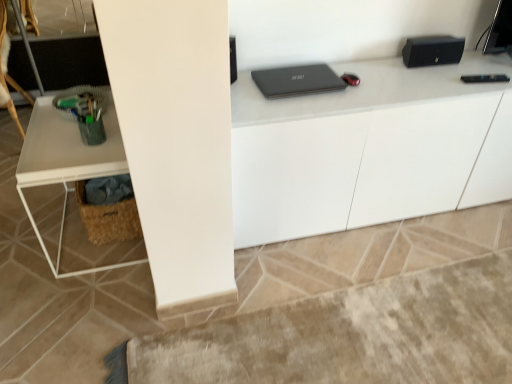
What do you see at coordinates (72, 182) in the screenshot? This screenshot has height=384, width=512. I see `white matte table at left, which is the 1th computer desk from left to right` at bounding box center [72, 182].

Describe the element at coordinates (297, 80) in the screenshot. The image size is (512, 384). I see `matte black laptop at center` at that location.

The width and height of the screenshot is (512, 384). What are the coordinates of `matte black laptop at center` in the screenshot? It's located at (297, 80).

What is the approximate width of white glossy cabinet at upper center, the second computer desk when ordered from left to right?

17.63 inches.

Identify the location of woven brown basket at lower left. (108, 218).

Is matte black laptop at center bigger than white glossy cabinet at upper center, the second computer desk when ordered from left to right?

Actually, matte black laptop at center might be smaller than white glossy cabinet at upper center, the second computer desk when ordered from left to right.

Is matte black laptop at center thinner than white glossy cabinet at upper center, which appears as the first computer desk when viewed from the right?

Indeed, matte black laptop at center has a lesser width compared to white glossy cabinet at upper center, which appears as the first computer desk when viewed from the right.

Can you confirm if matte black laptop at center is positioned to the right of white glossy cabinet at upper center, which appears as the first computer desk when viewed from the right?

No.

Consider the image. From a real-world perspective, is matte black laptop at center located beneath white glossy cabinet at upper center, the second computer desk when ordered from left to right?

Actually, matte black laptop at center is physically above white glossy cabinet at upper center, the second computer desk when ordered from left to right, in the real world.

Considering the points (20, 89) and (97, 242), which point is in front, point (20, 89) or point (97, 242)?

The point (97, 242) is in front.

From a real-world perspective, is wooden swivel chair at left located beneath woven brown basket at lower left?

No, from a real-world perspective, wooden swivel chair at left is not under woven brown basket at lower left.

Does wooden swivel chair at left appear on the left side of woven brown basket at lower left?

Yes, wooden swivel chair at left is to the left of woven brown basket at lower left.

Is matte black laptop at center further to the viewer compared to wooden swivel chair at left?

No, it is not.

Is matte black laptop at center facing away from wooden swivel chair at left?

matte black laptop at center does not have its back to wooden swivel chair at left.

Based on the photo, does matte black laptop at center contain wooden swivel chair at left?

No, matte black laptop at center does not contain wooden swivel chair at left.

Between point (4, 72) and point (271, 86), which one is positioned in front?

The point (271, 86) is closer to the camera.

Is wooden swivel chair at left facing away from matte black laptop at center?

That's not correct — wooden swivel chair at left is not looking away from matte black laptop at center.

In the scene shown: From the image's perspective, is wooden swivel chair at left located beneath matte black laptop at center?

No, from the image's perspective, wooden swivel chair at left is not below matte black laptop at center.

Considering the relative sizes of wooden swivel chair at left and matte black laptop at center in the image provided, is wooden swivel chair at left shorter than matte black laptop at center?

Incorrect, the height of wooden swivel chair at left does not fall short of that of matte black laptop at center.

From the image's perspective, between woven brown basket at lower left and matte black laptop at center, which one is located above?

From the image's view, matte black laptop at center is above.

Which is in front, woven brown basket at lower left or matte black laptop at center?

Positioned in front is matte black laptop at center.

Which is more to the left, woven brown basket at lower left or matte black laptop at center?

woven brown basket at lower left.

Does white matte table at left, the second computer desk when ordered from right to left, come in front of woven brown basket at lower left?

Yes, white matte table at left, the second computer desk when ordered from right to left, is closer to the camera.

Does white matte table at left, which is the 1th computer desk from left to right, have a lesser width compared to woven brown basket at lower left?

No, white matte table at left, which is the 1th computer desk from left to right, is not thinner than woven brown basket at lower left.

Is white matte table at left, which is the 1th computer desk from left to right, oriented towards woven brown basket at lower left?

Yes, white matte table at left, which is the 1th computer desk from left to right, is facing woven brown basket at lower left.

Could you tell me if white matte table at left, the second computer desk when ordered from right to left, is facing matte black laptop at center?

No, white matte table at left, the second computer desk when ordered from right to left, does not turn towards matte black laptop at center.

Does white matte table at left, which is the 1th computer desk from left to right, have a lesser height compared to matte black laptop at center?

Incorrect, the height of white matte table at left, which is the 1th computer desk from left to right, does not fall short of that of matte black laptop at center.

Considering the positions of objects white matte table at left, which is the 1th computer desk from left to right, and matte black laptop at center in the image provided, who is in front, white matte table at left, which is the 1th computer desk from left to right, or matte black laptop at center?

white matte table at left, which is the 1th computer desk from left to right, is in front.

You are a GUI agent. You are given a task and a screenshot of the screen. Output one action in this format:
    pyautogui.click(x=<x>, y=<y>)
    Task: Click on the laptop on the left side of white glossy cabinet at upper center, the second computer desk when ordered from left to right
    The width and height of the screenshot is (512, 384).
    Given the screenshot: What is the action you would take?
    pyautogui.click(x=297, y=80)

Locate an element on the screen. swivel chair that appears behind the woven brown basket at lower left is located at coordinates (9, 49).

When comparing their distances from white glossy cabinet at upper center, which appears as the first computer desk when viewed from the right, does matte black laptop at center or white matte table at left, the second computer desk when ordered from right to left, seem further?

white matte table at left, the second computer desk when ordered from right to left, is further to white glossy cabinet at upper center, which appears as the first computer desk when viewed from the right.

Based on their spatial positions, is woven brown basket at lower left or white glossy cabinet at upper center, the second computer desk when ordered from left to right, closer to wooden swivel chair at left?

woven brown basket at lower left is positioned closer to the anchor wooden swivel chair at left.

Consider the image. From the image, which object appears to be nearer to woven brown basket at lower left, wooden swivel chair at left or white glossy cabinet at upper center, which appears as the first computer desk when viewed from the right?

Based on the image, white glossy cabinet at upper center, which appears as the first computer desk when viewed from the right, appears to be nearer to woven brown basket at lower left.

Which object lies further to the anchor point matte black laptop at center, white glossy cabinet at upper center, which appears as the first computer desk when viewed from the right, or wooden swivel chair at left?

wooden swivel chair at left is further to matte black laptop at center.

When comparing their distances from white matte table at left, which is the 1th computer desk from left to right, does woven brown basket at lower left or matte black laptop at center seem closer?

woven brown basket at lower left is positioned closer to the anchor white matte table at left, which is the 1th computer desk from left to right.

Considering their positions, is woven brown basket at lower left positioned closer to white matte table at left, the second computer desk when ordered from right to left, than white glossy cabinet at upper center, which appears as the first computer desk when viewed from the right?

A: woven brown basket at lower left lies closer to white matte table at left, the second computer desk when ordered from right to left, than the other object.

Based on their spatial positions, is white matte table at left, the second computer desk when ordered from right to left, or matte black laptop at center further from woven brown basket at lower left?

Among the two, matte black laptop at center is located further to woven brown basket at lower left.

Looking at the image, which one is located further to white matte table at left, the second computer desk when ordered from right to left, white glossy cabinet at upper center, the second computer desk when ordered from left to right, or matte black laptop at center?

white glossy cabinet at upper center, the second computer desk when ordered from left to right, lies further to white matte table at left, the second computer desk when ordered from right to left, than the other object.

This screenshot has height=384, width=512. In order to click on basket between white matte table at left, the second computer desk when ordered from right to left, and matte black laptop at center, in the horizontal direction in this screenshot , I will do `click(108, 218)`.

Find the location of a particular element. basket between white matte table at left, the second computer desk when ordered from right to left, and white glossy cabinet at upper center, the second computer desk when ordered from left to right, from left to right is located at coordinates (108, 218).

The height and width of the screenshot is (384, 512). I want to click on laptop between wooden swivel chair at left and white glossy cabinet at upper center, the second computer desk when ordered from left to right, from left to right, so click(297, 80).

Where is `basket situated between wooden swivel chair at left and matte black laptop at center from left to right`? The width and height of the screenshot is (512, 384). basket situated between wooden swivel chair at left and matte black laptop at center from left to right is located at coordinates (108, 218).